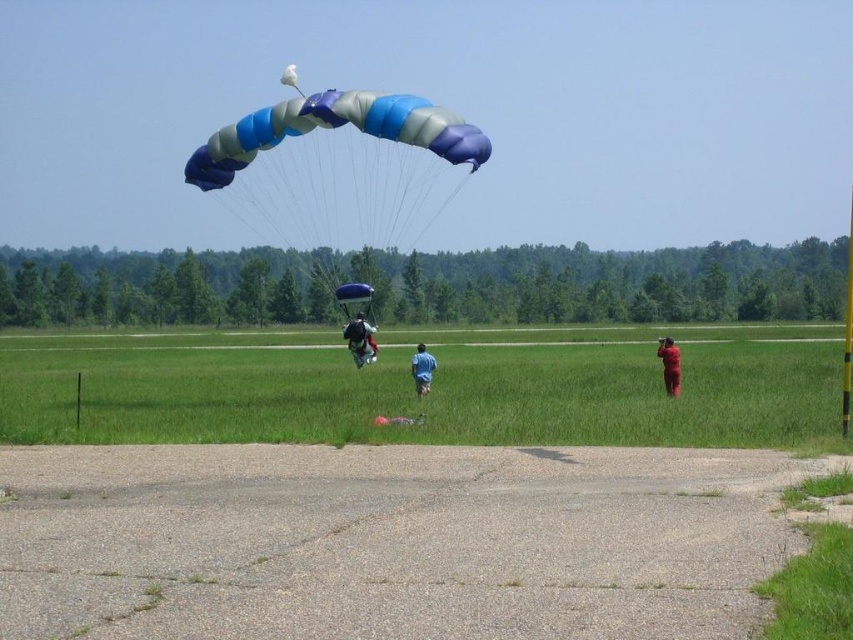
Question: Can you confirm if blue/white/grey fabric parachute at center is wider than matte black backpack at center?

Choices:
 (A) yes
 (B) no

Answer: (A)

Question: Is green grass at center in front of matte black backpack at center?

Choices:
 (A) no
 (B) yes

Answer: (B)

Question: Considering the real-world distances, which object is closest to the red fabric person at right?

Choices:
 (A) blue/white/grey fabric parachute at center
 (B) green grass at center
 (C) blue fabric parachute at center
 (D) matte black backpack at center

Answer: (C)

Question: Which is farther from the matte black backpack at center?

Choices:
 (A) blue fabric parachute at center
 (B) green grass at center
 (C) blue/white/grey fabric parachute at center

Answer: (C)

Question: Which point is farther to the camera?

Choices:
 (A) (677, 394)
 (B) (387, 97)
 (C) (352, 353)
 (D) (422, 376)

Answer: (C)

Question: Considering the relative positions of green grass at center and blue fabric parachute at center in the image provided, where is green grass at center located with respect to blue fabric parachute at center?

Choices:
 (A) left
 (B) right

Answer: (A)